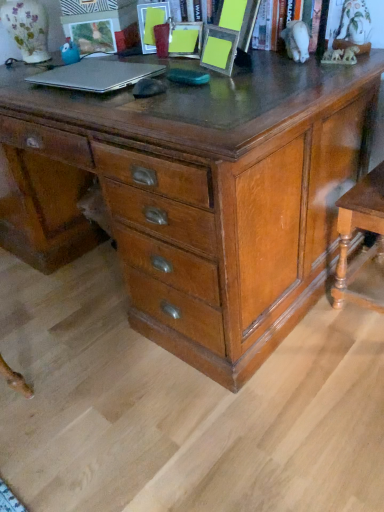
Locate an element on the screen. Image resolution: width=384 pixels, height=512 pixels. vacant space in front of yellow paper at upper center is located at coordinates (239, 84).